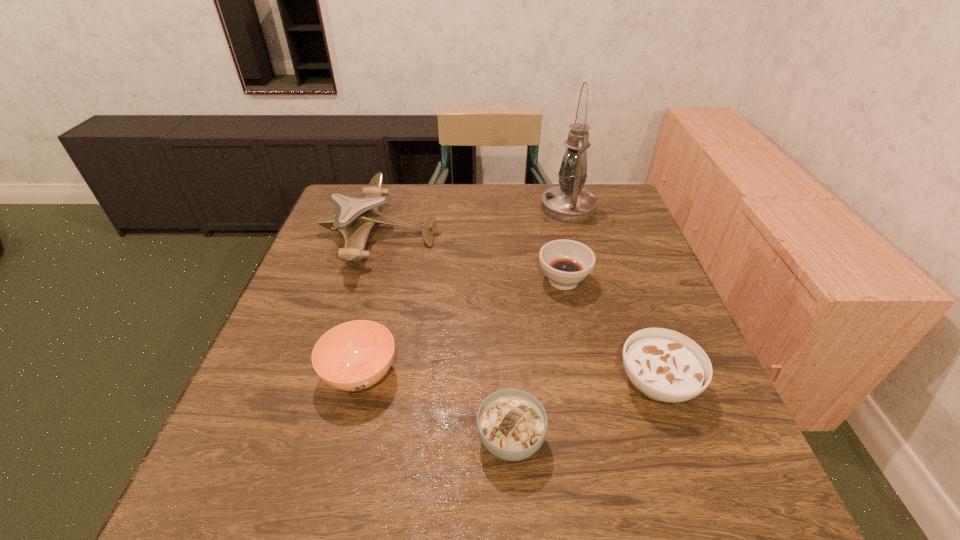
Identify the location of oil lamp at the far edge. The image size is (960, 540). (569, 203).

You are a GUI agent. You are given a task and a screenshot of the screen. Output one action in this format:
    pyautogui.click(x=<x>, y=<y>)
    Task: Click on the drone present at the far edge
    
    Given the screenshot: What is the action you would take?
    pyautogui.click(x=355, y=216)

Identify the location of object present at the near edge. The width and height of the screenshot is (960, 540). (512, 424).

Find the location of a particular element. This screenshot has width=960, height=540. drone that is at the left edge is located at coordinates (355, 216).

You are a GUI agent. You are given a task and a screenshot of the screen. Output one action in this format:
    pyautogui.click(x=<x>, y=<y>)
    Task: Click on the soup bowl that is at the left edge
    
    Given the screenshot: What is the action you would take?
    pyautogui.click(x=355, y=355)

Identify the location of oil lamp situated at the right edge. The image size is (960, 540). (569, 203).

Where is `soup bowl that is at the right edge`? The height and width of the screenshot is (540, 960). soup bowl that is at the right edge is located at coordinates (667, 366).

Locate an element on the screen. The height and width of the screenshot is (540, 960). object that is at the far left corner is located at coordinates (355, 216).

Find the location of a particular element. object at the far right corner is located at coordinates (569, 203).

In the image, there is a desktop. Identify the location of vacant space at the far edge. (485, 200).